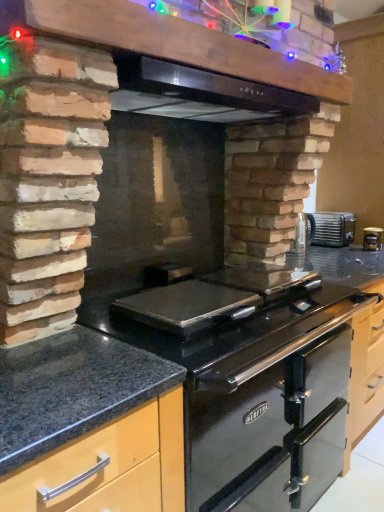
Where is `vacant space situated above metallic silver toaster at upper center (from a real-world perspective)`? This screenshot has width=384, height=512. vacant space situated above metallic silver toaster at upper center (from a real-world perspective) is located at coordinates (327, 212).